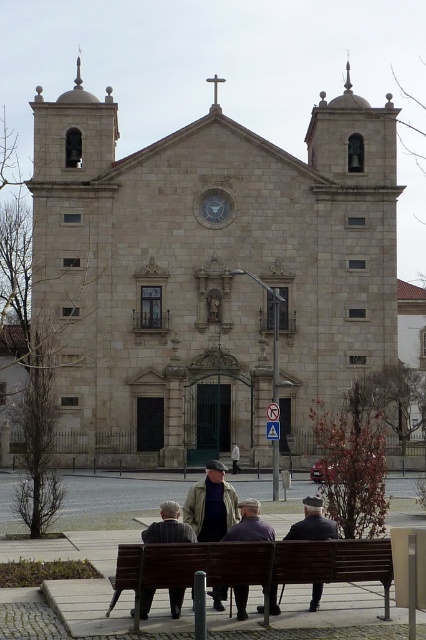
Between dark brown wood bench at lower center and khaki fabric jacket at center, which one appears on the left side from the viewer's perspective?

From the viewer's perspective, khaki fabric jacket at center appears more on the left side.

Find the location of a particular element. dark brown wood bench at lower center is located at coordinates (222, 509).

Is point (204, 529) farther from viewer compared to point (178, 516)?

Yes, point (204, 529) is farther from viewer.

Who is more forward, (227, 515) or (172, 609)?

Point (172, 609) is in front.

Where is `khaki fabric jacket at center`? khaki fabric jacket at center is located at coordinates (210, 504).

Which is behind, point (77, 428) or point (190, 540)?

The point (77, 428) is behind.

Between point (80, 276) and point (146, 540), which one is positioned in front?

Positioned in front is point (146, 540).

This screenshot has height=640, width=426. Identify the location of beige stone church at center. (210, 269).